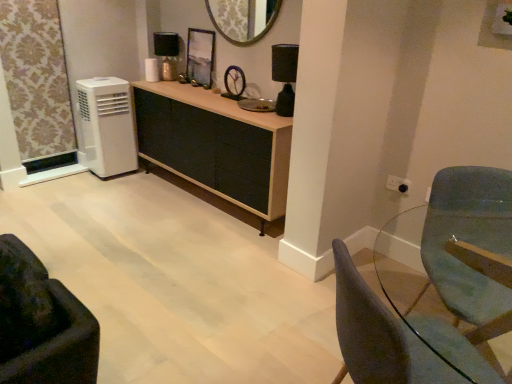
The image size is (512, 384). What do you see at coordinates (215, 145) in the screenshot?
I see `wooden cabinet at center` at bounding box center [215, 145].

What do you see at coordinates (42, 324) in the screenshot? I see `velvet dark brown armchair at lower left, the second chair when ordered from right to left` at bounding box center [42, 324].

Find the location of a particular element. This screenshot has width=512, height=384. teal fabric swivel chair at right is located at coordinates (468, 240).

The height and width of the screenshot is (384, 512). I want to click on matte gray chair at lower right, placed as the second chair when sorted from left to right, so click(x=398, y=339).

Where is `metallic gold lamp at upper center, the 2th lamp in the front-to-back sequence`? metallic gold lamp at upper center, the 2th lamp in the front-to-back sequence is located at coordinates click(x=167, y=53).

I want to click on black matte lamp at upper right, which is the 2th lamp from left to right, so click(x=284, y=76).

Considering the sizes of black matte lamp at upper right, which appears as the 1th lamp when viewed from the right, and gold textured mirror at upper center in the image, is black matte lamp at upper right, which appears as the 1th lamp when viewed from the right, taller or shorter than gold textured mirror at upper center?

Clearly, black matte lamp at upper right, which appears as the 1th lamp when viewed from the right, is taller compared to gold textured mirror at upper center.

Consider the image. From the image's perspective, between black matte lamp at upper right, which is the second lamp from back to front, and gold textured mirror at upper center, who is located below?

black matte lamp at upper right, which is the second lamp from back to front, is shown below in the image.

From a real-world perspective, which is physically above, black matte lamp at upper right, which appears as the 1th lamp when viewed from the right, or gold textured mirror at upper center?

gold textured mirror at upper center is physically above.

Between point (286, 68) and point (234, 11), which one is positioned behind?

The point (234, 11) is farther from the camera.

Would you say matte gray chair at lower right, the first chair when ordered from right to left, is outside gold textured mirror at upper center?

Yes, matte gray chair at lower right, the first chair when ordered from right to left, is not within gold textured mirror at upper center.

From the image's perspective, is matte gray chair at lower right, the first chair when ordered from right to left, below gold textured mirror at upper center?

Yes, from the image's perspective, matte gray chair at lower right, the first chair when ordered from right to left, is beneath gold textured mirror at upper center.

Is matte gray chair at lower right, placed as the second chair when sorted from left to right, oriented away from gold textured mirror at upper center?

matte gray chair at lower right, placed as the second chair when sorted from left to right, is not turned away from gold textured mirror at upper center.

Which is more to the left, black matte lamp at upper right, which is the 2th lamp from left to right, or teal fabric swivel chair at right?

From the viewer's perspective, black matte lamp at upper right, which is the 2th lamp from left to right, appears more on the left side.

Which is behind, point (292, 56) or point (440, 277)?

The point (292, 56) is behind.

Based on their sizes in the image, would you say black matte lamp at upper right, which is counted as the first lamp, starting from the bottom, is bigger or smaller than teal fabric swivel chair at right?

black matte lamp at upper right, which is counted as the first lamp, starting from the bottom, is smaller than teal fabric swivel chair at right.

Where is `the 1st lamp counting from the left side of the teal fabric swivel chair at right`? This screenshot has width=512, height=384. the 1st lamp counting from the left side of the teal fabric swivel chair at right is located at coordinates [x=284, y=76].

Is velvet dark brown armchair at lower left, the 1th chair in the left-to-right sequence, aimed at matte gray chair at lower right, the first chair when ordered from right to left?

No, velvet dark brown armchair at lower left, the 1th chair in the left-to-right sequence, is not oriented towards matte gray chair at lower right, the first chair when ordered from right to left.

Could you measure the distance between velvet dark brown armchair at lower left, the 1th chair in the left-to-right sequence, and matte gray chair at lower right, the first chair when ordered from right to left?

velvet dark brown armchair at lower left, the 1th chair in the left-to-right sequence, is 32.77 inches away from matte gray chair at lower right, the first chair when ordered from right to left.

Can you confirm if velvet dark brown armchair at lower left, the second chair when ordered from right to left, is smaller than matte gray chair at lower right, placed as the second chair when sorted from left to right?

Yes, velvet dark brown armchair at lower left, the second chair when ordered from right to left, is smaller than matte gray chair at lower right, placed as the second chair when sorted from left to right.

Is velvet dark brown armchair at lower left, the second chair when ordered from right to left, thinner than matte gray chair at lower right, placed as the second chair when sorted from left to right?

Yes, velvet dark brown armchair at lower left, the second chair when ordered from right to left, is thinner than matte gray chair at lower right, placed as the second chair when sorted from left to right.

Looking at this image, which point is more distant from viewer, (157, 54) or (294, 53)?

Point (157, 54)

Between metallic gold lamp at upper center, the 2th lamp in the front-to-back sequence, and black matte lamp at upper right, which is the 2th lamp from left to right, which one appears on the right side from the viewer's perspective?

black matte lamp at upper right, which is the 2th lamp from left to right, is more to the right.

Can you confirm if metallic gold lamp at upper center, the 2th lamp in the front-to-back sequence, is smaller than black matte lamp at upper right, which is the 2th lamp from left to right?

Yes, metallic gold lamp at upper center, the 2th lamp in the front-to-back sequence, is smaller than black matte lamp at upper right, which is the 2th lamp from left to right.

Considering their positions, is metallic gold lamp at upper center, the 1th lamp when ordered from top to bottom, located in front of or behind black matte lamp at upper right, which is counted as the first lamp, starting from the bottom?

In the image, metallic gold lamp at upper center, the 1th lamp when ordered from top to bottom, appears behind black matte lamp at upper right, which is counted as the first lamp, starting from the bottom.

Considering the points (161, 47) and (82, 322), which point is in front, point (161, 47) or point (82, 322)?

The point (82, 322) is in front.

From the image's perspective, count 2nd chairs downward from the metallic gold lamp at upper center, the 1th lamp when ordered from top to bottom, and point to it. Please provide its 2D coordinates.

[(42, 324)]

Which of these two, metallic gold lamp at upper center, the 1th lamp when ordered from top to bottom, or velvet dark brown armchair at lower left, the second chair when ordered from right to left, stands shorter?

metallic gold lamp at upper center, the 1th lamp when ordered from top to bottom.

Could you measure the distance between white plastic air conditioner at left and black matte lamp at upper right, which is the second lamp from back to front?

white plastic air conditioner at left is 1.58 meters from black matte lamp at upper right, which is the second lamp from back to front.

The height and width of the screenshot is (384, 512). I want to click on the 1st lamp above the white plastic air conditioner at left (from the image's perspective), so click(284, 76).

Which object is positioned more to the right, white plastic air conditioner at left or black matte lamp at upper right, which appears as the 1th lamp when viewed from the right?

From the viewer's perspective, black matte lamp at upper right, which appears as the 1th lamp when viewed from the right, appears more on the right side.

The width and height of the screenshot is (512, 384). What are the coordinates of `the 2nd lamp positioned below the gold textured mirror at upper center (from the image's perspective)` in the screenshot? It's located at (284, 76).

You are a GUI agent. You are given a task and a screenshot of the screen. Output one action in this format:
    pyautogui.click(x=<x>, y=<y>)
    Task: Click on the mirror above the matte gray chair at lower right, the first chair when ordered from right to left (from the image's perspective)
    Image resolution: width=512 pixels, height=384 pixels.
    Given the screenshot: What is the action you would take?
    pyautogui.click(x=243, y=19)

From the picture: Looking at the image, which one is located further to velvet dark brown armchair at lower left, the 1th chair in the left-to-right sequence, matte gray chair at lower right, the first chair when ordered from right to left, or white plastic air conditioner at left?

Based on the image, white plastic air conditioner at left appears to be further to velvet dark brown armchair at lower left, the 1th chair in the left-to-right sequence.

Which object lies nearer to the anchor point matte gray chair at lower right, the first chair when ordered from right to left, white plastic air conditioner at left or velvet dark brown armchair at lower left, the 1th chair in the left-to-right sequence?

Among the two, velvet dark brown armchair at lower left, the 1th chair in the left-to-right sequence, is located nearer to matte gray chair at lower right, the first chair when ordered from right to left.

Which object lies nearer to the anchor point white plastic air conditioner at left, metallic reflective frame at center or matte gray chair at lower right, the first chair when ordered from right to left?

The object closer to white plastic air conditioner at left is metallic reflective frame at center.

Considering their positions, is teal fabric swivel chair at right positioned further to wooden cabinet at center than velvet dark brown armchair at lower left, the 1th chair in the left-to-right sequence?

Based on the image, velvet dark brown armchair at lower left, the 1th chair in the left-to-right sequence, appears to be further to wooden cabinet at center.

Considering their positions, is black matte lamp at upper right, which appears as the first lamp when viewed from the front, positioned further to matte gray chair at lower right, the first chair when ordered from right to left, than wooden cabinet at center?

Based on the image, wooden cabinet at center appears to be further to matte gray chair at lower right, the first chair when ordered from right to left.

Looking at the image, which one is located further to teal fabric swivel chair at right, black matte lamp at upper right, the second lamp positioned from the top, or white plastic air conditioner at left?

Based on the image, white plastic air conditioner at left appears to be further to teal fabric swivel chair at right.

Based on their spatial positions, is white plastic air conditioner at left or teal fabric swivel chair at right further from velvet dark brown armchair at lower left, the second chair when ordered from right to left?

white plastic air conditioner at left lies further to velvet dark brown armchair at lower left, the second chair when ordered from right to left, than the other object.

Estimate the real-world distances between objects in this image. Which object is closer to velvet dark brown armchair at lower left, the 1th chair in the left-to-right sequence, matte gray chair at lower right, placed as the second chair when sorted from left to right, or metallic gold lamp at upper center, positioned as the second lamp in right-to-left order?

matte gray chair at lower right, placed as the second chair when sorted from left to right.

This screenshot has height=384, width=512. I want to click on lamp located between matte gray chair at lower right, the first chair when ordered from right to left, and white plastic air conditioner at left in the depth direction, so click(284, 76).

Image resolution: width=512 pixels, height=384 pixels. Identify the location of air conditioning between wooden cabinet at center and metallic gold lamp at upper center, positioned as the second lamp in right-to-left order, from front to back. (106, 126).

At what (x,y) coordinates should I click in order to perform the action: click on swivel chair between gold textured mirror at upper center and velvet dark brown armchair at lower left, the second chair when ordered from right to left, in the up-down direction. Please return your answer as a coordinate pair (x, y). The height and width of the screenshot is (384, 512). Looking at the image, I should click on (468, 240).

At what (x,y) coordinates should I click in order to perform the action: click on picture frame between gold textured mirror at upper center and metallic gold lamp at upper center, positioned as the second lamp in right-to-left order, in the front-back direction. Please return your answer as a coordinate pair (x, y). Image resolution: width=512 pixels, height=384 pixels. Looking at the image, I should click on (200, 58).